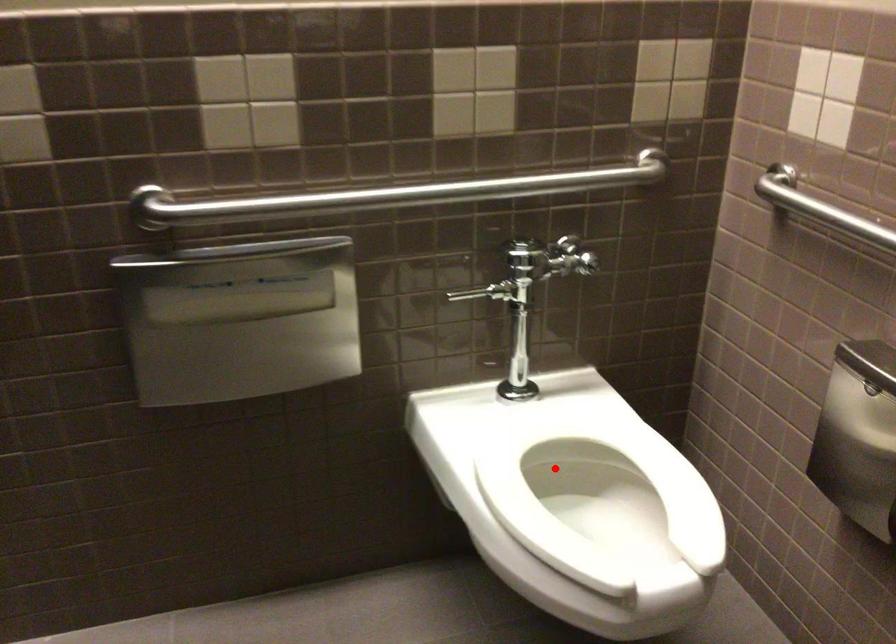
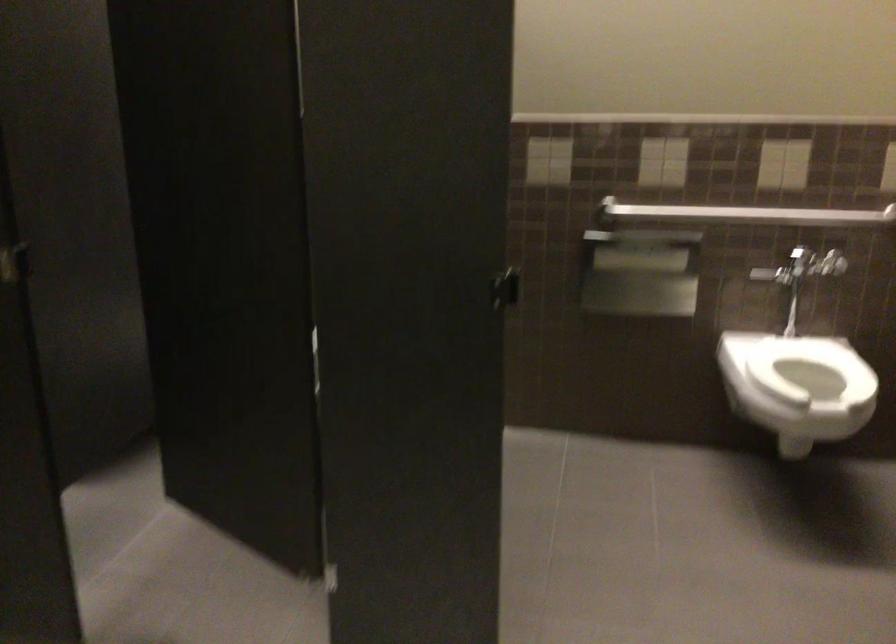
Question: I am providing you with two images of the same scene from different viewpoints. Image1 has a red point marked. In image2, the corresponding 3D location appears at what relative position? Reply with the corresponding letter.

Choices:
 (A) Closer
 (B) Farther

Answer: (B)